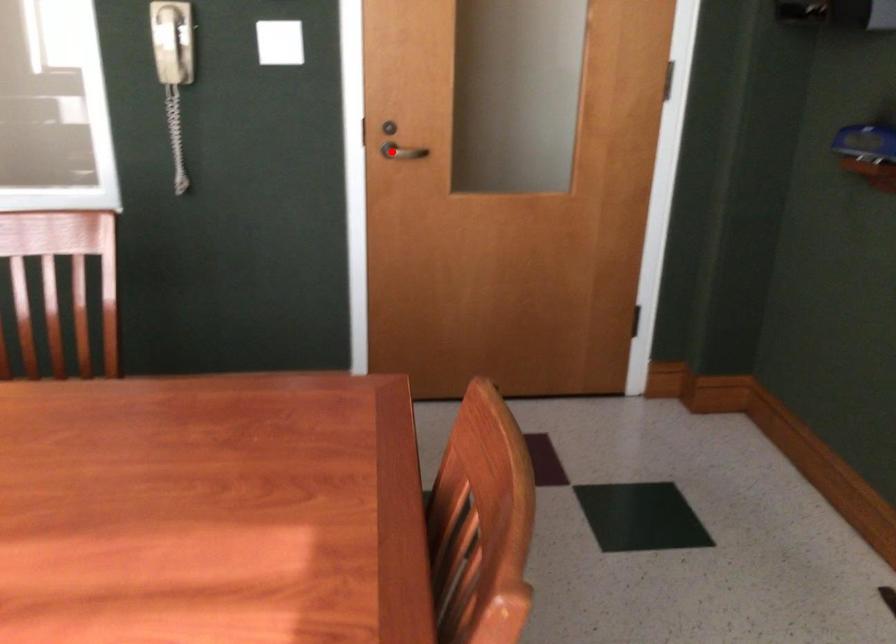
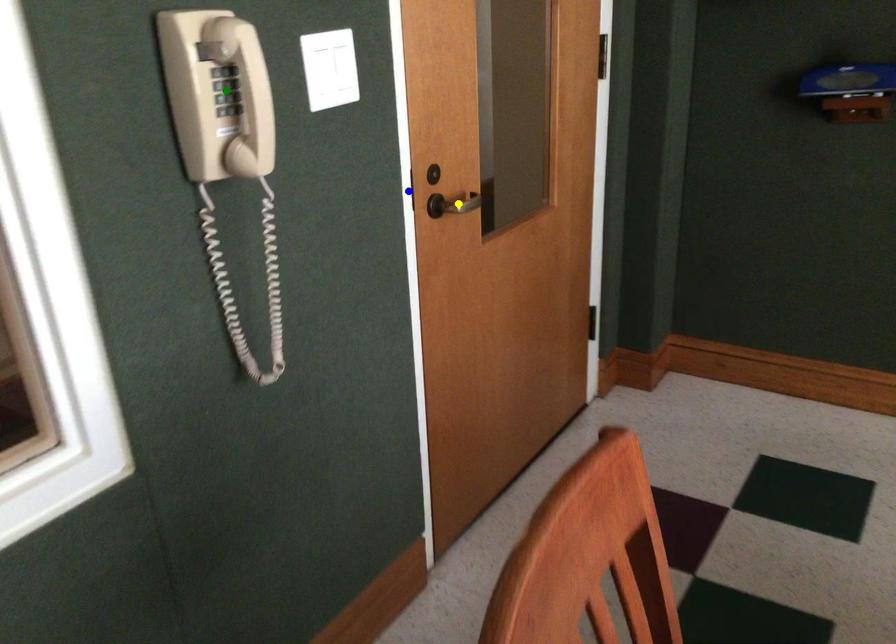
Question: I am providing you with two images of the same scene from different viewpoints. A red point is marked on the first image. You are given multiple points on the second image. Which mark in image 2 goes with the point in image 1?

Choices:
 (A) green point
 (B) blue point
 (C) yellow point

Answer: (C)